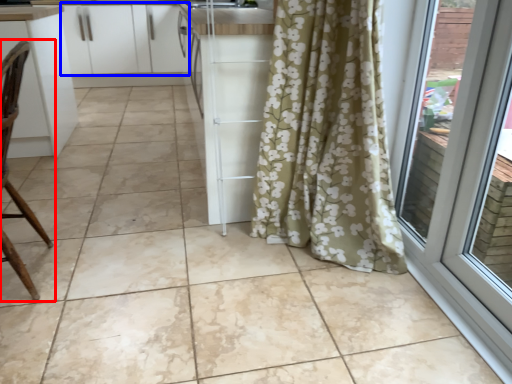
Question: Among these objects, which one is farthest to the camera, chair (highlighted by a red box) or cabinetry (highlighted by a blue box)?

Choices:
 (A) chair
 (B) cabinetry

Answer: (B)